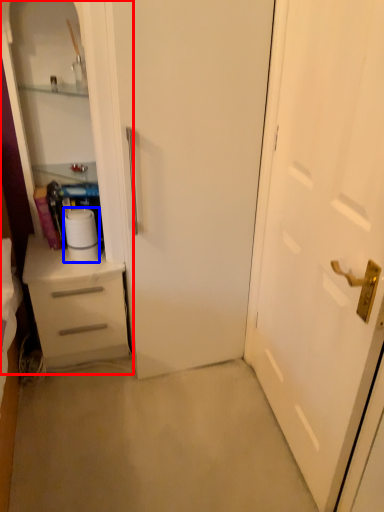
Question: Among these objects, which one is farthest to the camera, dresser (highlighted by a red box) or paper towel (highlighted by a blue box)?

Choices:
 (A) dresser
 (B) paper towel

Answer: (B)